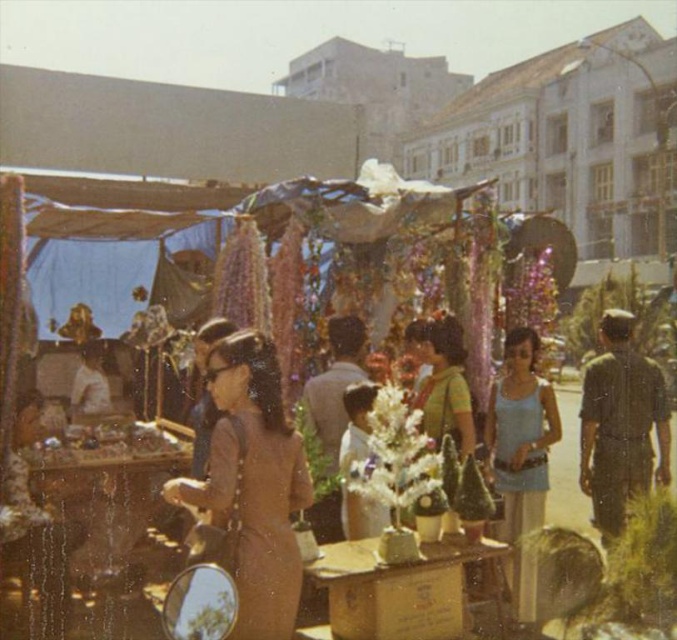
Question: Based on their relative distances, which object is farther from the dark green uniform at right?

Choices:
 (A) brown matte dress at center
 (B) light blue tank top at center

Answer: (A)

Question: Does dark green uniform at right have a lesser width compared to light blue tank top at center?

Choices:
 (A) no
 (B) yes

Answer: (A)

Question: Does brown matte dress at center appear over green textured blouse at center?

Choices:
 (A) no
 (B) yes

Answer: (A)

Question: Which object is positioned closest to the brown matte dress at center?

Choices:
 (A) dark green uniform at right
 (B) light blue tank top at center
 (C) green textured blouse at center

Answer: (C)

Question: Does dark green uniform at right appear on the right side of green textured blouse at center?

Choices:
 (A) yes
 (B) no

Answer: (A)

Question: Which is nearer to the dark green uniform at right?

Choices:
 (A) brown matte dress at center
 (B) light blue tank top at center
 (C) green textured blouse at center

Answer: (B)